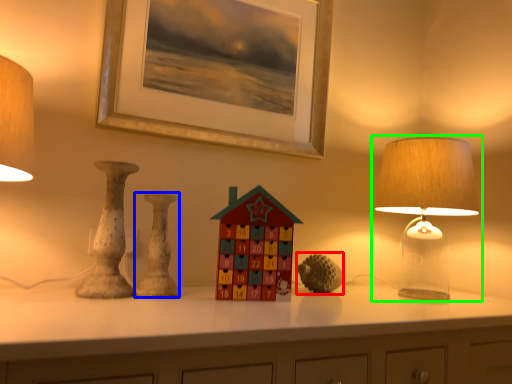
Question: Which object is positioned closest to toy (highlighted by a red box)? Select from vase (highlighted by a blue box) and lamp (highlighted by a green box).

Choices:
 (A) vase
 (B) lamp

Answer: (B)